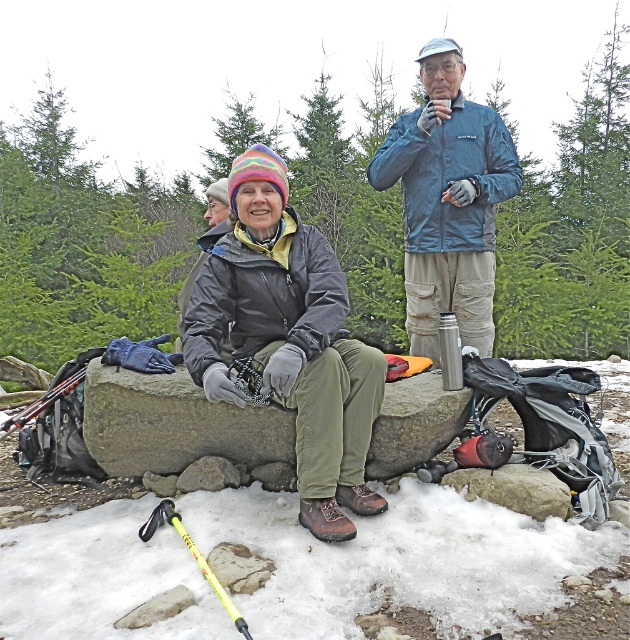
You are a hiker trying to identify your friend who is wearing a matte black jacket at center and another wearing a blue textured jacket at upper center. Which friend is closer to the left side of the scene?

The matte black jacket at center is positioned on the left side of the blue textured jacket at upper center, so the friend wearing the matte black jacket at center is closer to the left side of the scene.

You are a hiker trying to locate your gear. You see the blue textured jacket at upper center and the gray stone boulder at center. Which object is located to the right of the other?

The blue textured jacket at upper center is positioned on the right side of gray stone boulder at center, so the blue textured jacket at upper center is to the right of the gray stone boulder at center.